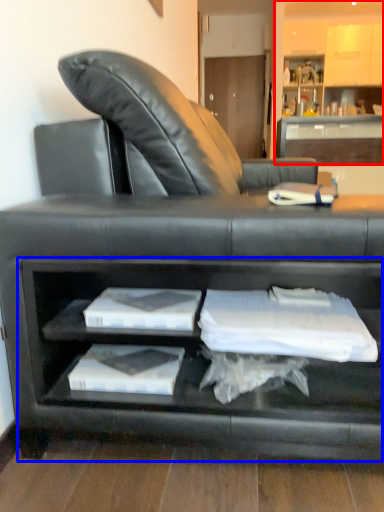
Question: Which object is further to the camera taking this photo, entertainment center (highlighted by a red box) or cabinet (highlighted by a blue box)?

Choices:
 (A) entertainment center
 (B) cabinet

Answer: (A)